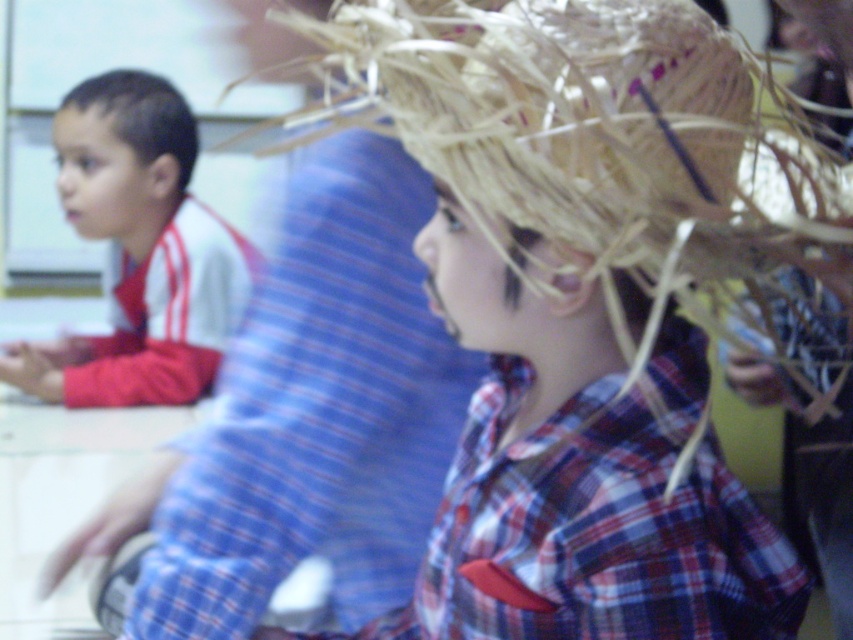
Between straw hat at upper right and brown matte hair at left, which one is positioned higher?

brown matte hair at left

Is point (351, 112) more distant than point (148, 150)?

No, it is not.

Does point (515, 164) lie behind point (132, 77)?

That is False.

The height and width of the screenshot is (640, 853). What are the coordinates of `straw hat at upper right` in the screenshot? It's located at (606, 150).

Is straw hat at upper right bigger than matte white shirt at left?

Correct, straw hat at upper right is larger in size than matte white shirt at left.

Can you confirm if straw hat at upper right is positioned above matte white shirt at left?

Yes, straw hat at upper right is above matte white shirt at left.

Who is more distant from viewer, (728, 138) or (10, 349)?

The point (10, 349) is more distant.

At what (x,y) coordinates should I click in order to perform the action: click on straw hat at upper right. Please return your answer as a coordinate pair (x, y). This screenshot has height=640, width=853. Looking at the image, I should click on (606, 150).

Between matte white shirt at left and brown matte hair at left, which one appears on the left side from the viewer's perspective?

From the viewer's perspective, matte white shirt at left appears more on the left side.

Is matte white shirt at left bigger than brown matte hair at left?

Correct, matte white shirt at left is larger in size than brown matte hair at left.

Is point (189, 321) farther from viewer compared to point (82, 84)?

No, (189, 321) is in front of (82, 84).

Find the location of `matte white shirt at left`. matte white shirt at left is located at coordinates (138, 252).